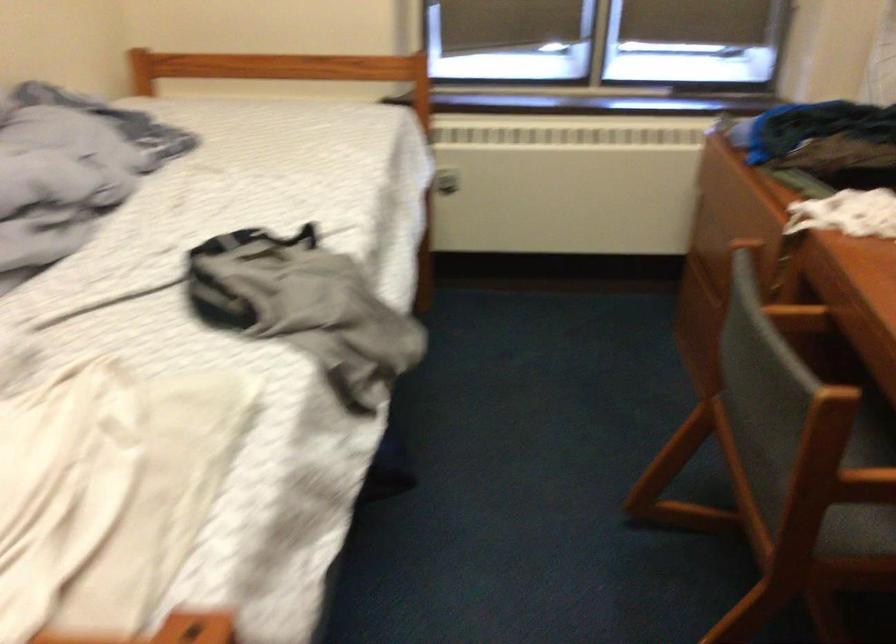
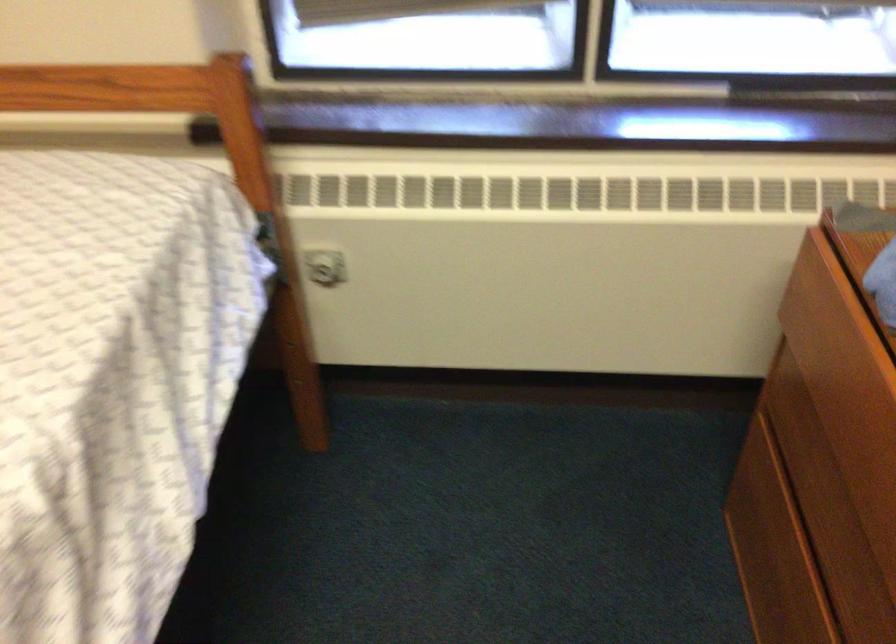
Question: Which direction would the cameraman need to move to produce the second image? Reply with the corresponding letter.

Choices:
 (A) Left
 (B) Right
 (C) Forward
 (D) Backward

Answer: (C)